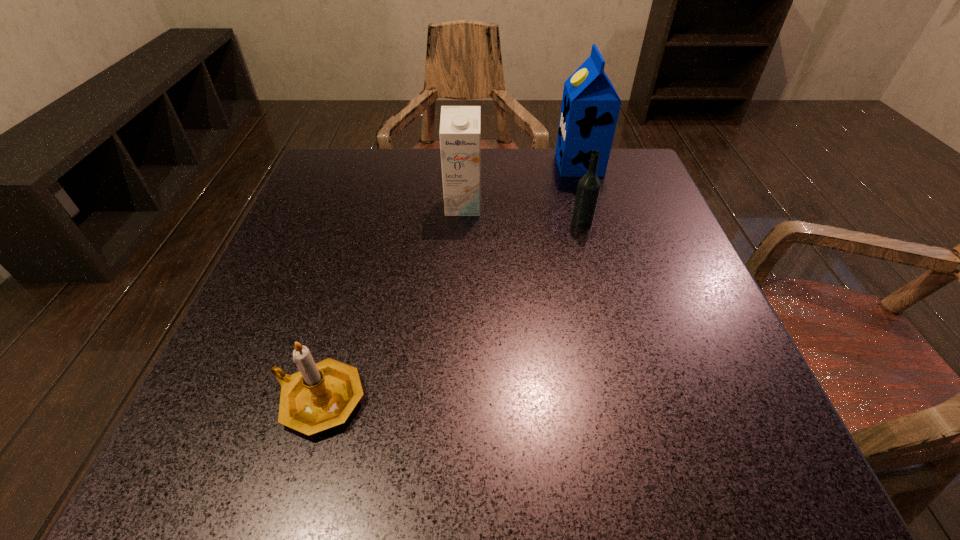
Find the location of `vacant position located on the front of the third shortest object`. vacant position located on the front of the third shortest object is located at coordinates (461, 254).

The image size is (960, 540). Find the location of `vacant region located on the front of the vodka`. vacant region located on the front of the vodka is located at coordinates (626, 389).

Locate an element on the screen. Image resolution: width=960 pixels, height=540 pixels. blank space located on the back of the shortest object is located at coordinates (354, 276).

Where is `object at the near edge`? The image size is (960, 540). object at the near edge is located at coordinates (320, 396).

This screenshot has width=960, height=540. Identify the location of object located at the left edge. (320, 396).

Locate an element on the screen. This screenshot has height=540, width=960. carton situated at the right edge is located at coordinates (590, 107).

Identify the location of vodka that is at the right edge. (589, 186).

The width and height of the screenshot is (960, 540). I want to click on object located in the near left corner section of the desktop, so click(320, 396).

You are a GUI agent. You are given a task and a screenshot of the screen. Output one action in this format:
    pyautogui.click(x=<x>, y=<y>)
    Task: Click on the object present at the far right corner
    
    Given the screenshot: What is the action you would take?
    pyautogui.click(x=590, y=107)

Find the location of a particular element. The image size is (960, 540). vacant space at the far edge of the desktop is located at coordinates (392, 199).